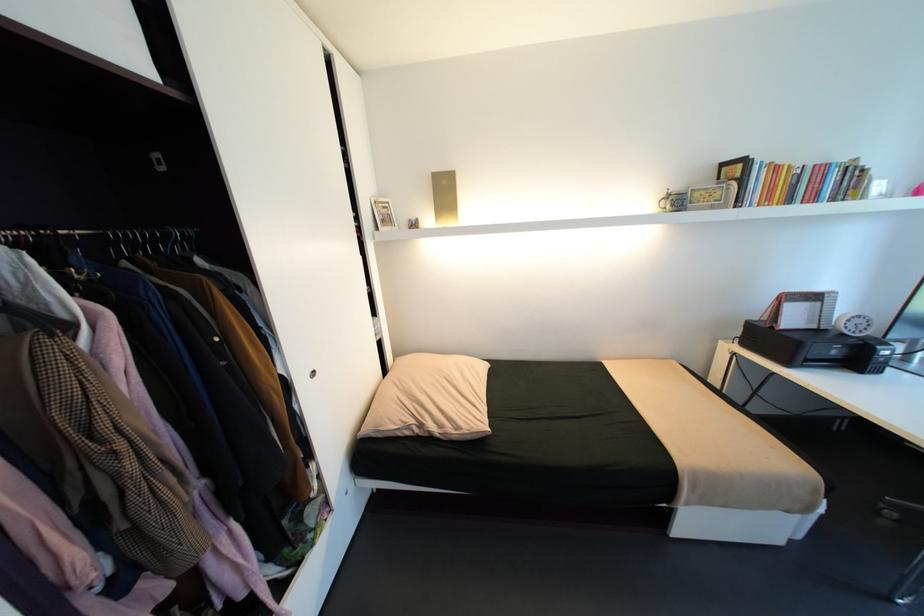
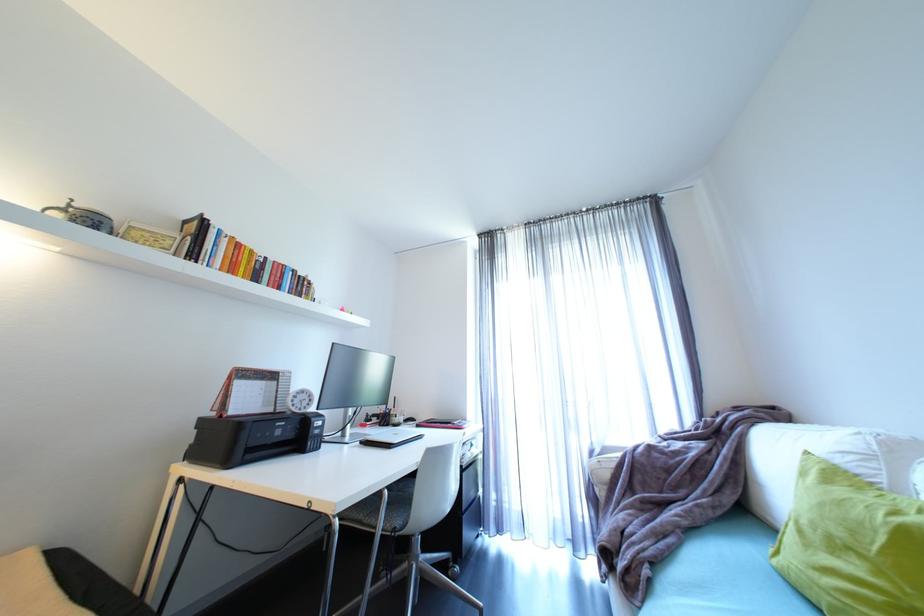
In the second image, find the point that corresponds to [869,326] in the first image.

(312, 402)